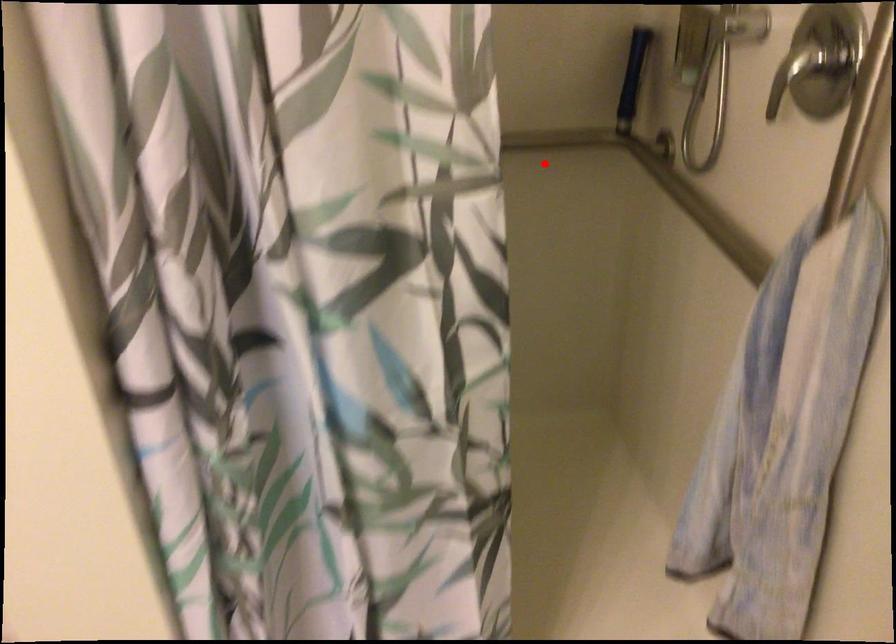
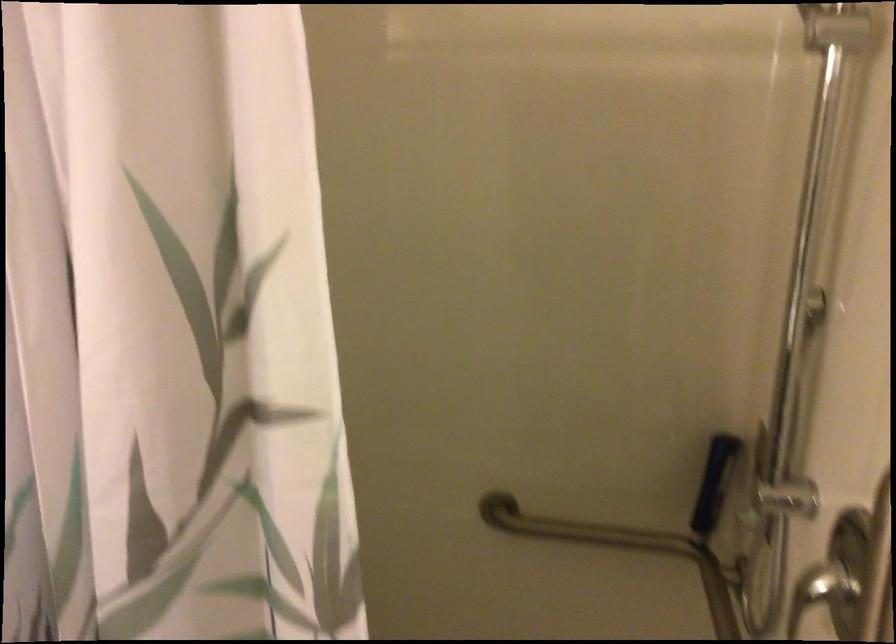
Find the pixel in the second image that matches the highlighted location in the first image.

(622, 549)